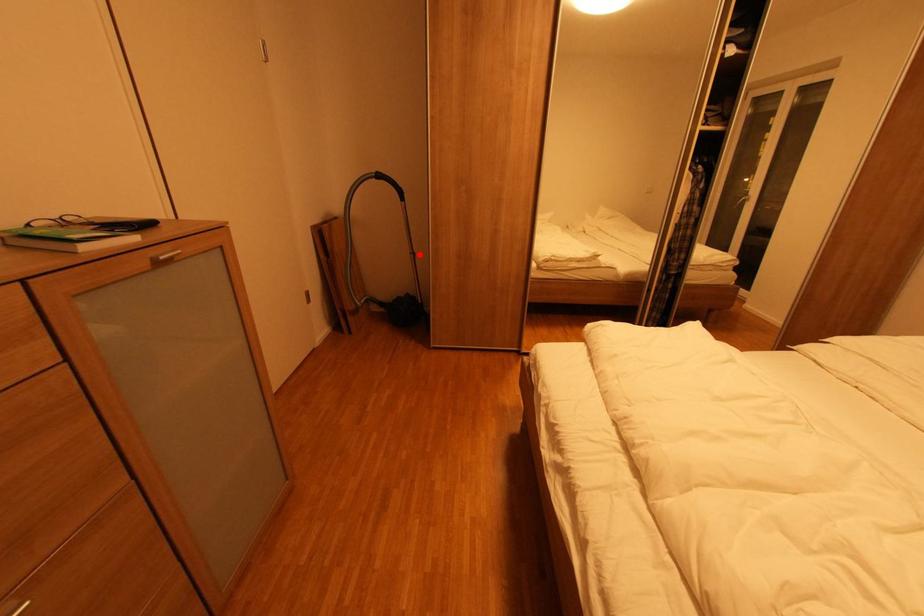
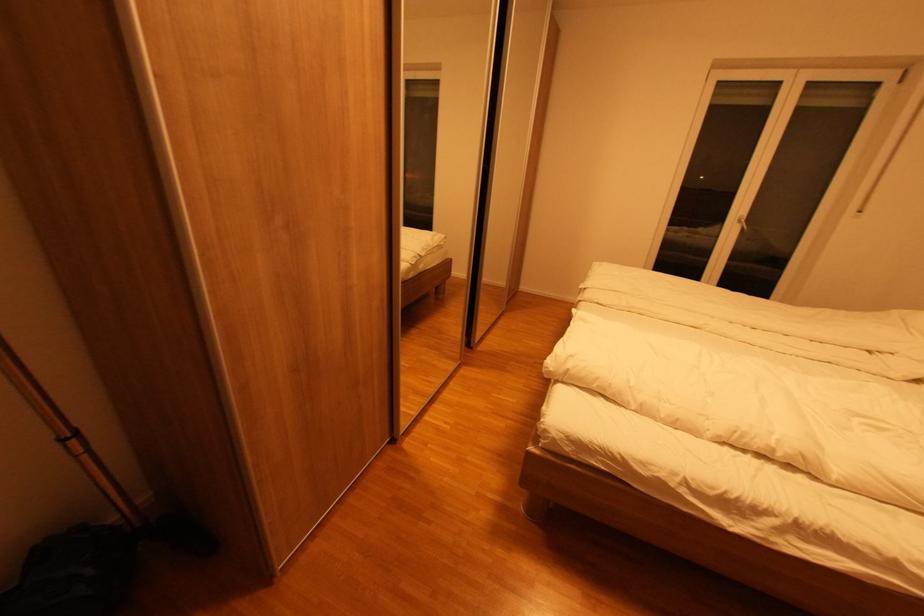
Find the pixel in the second image that matches the highlighted location in the first image.

(83, 434)